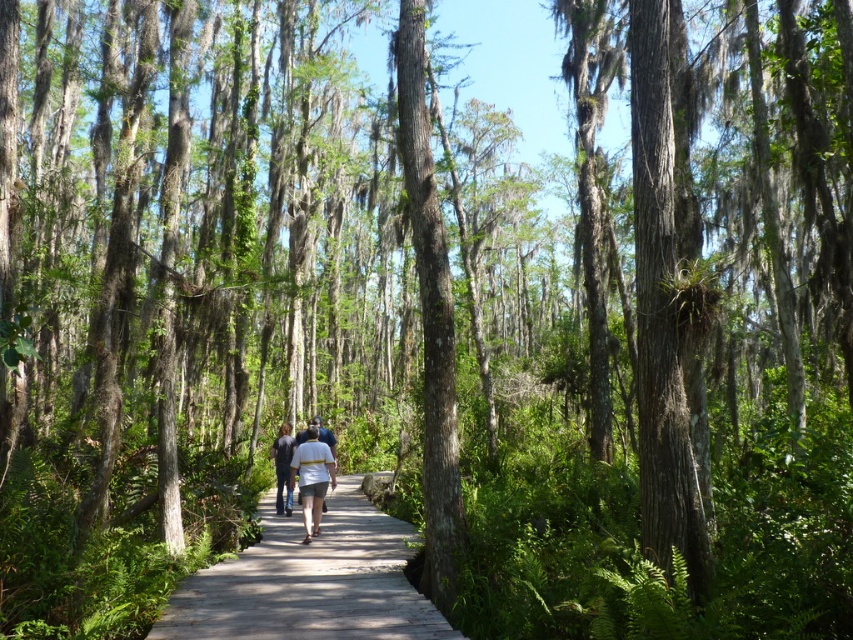
Question: Which object is closer to the camera taking this photo?

Choices:
 (A) wooden boardwalk at center
 (B) smooth bark tree at center

Answer: (A)

Question: Does smooth bark tree at center appear over dark blue jeans at center?

Choices:
 (A) no
 (B) yes

Answer: (B)

Question: Can you confirm if wooden boardwalk at center is positioned to the right of smooth bark tree at center?

Choices:
 (A) yes
 (B) no

Answer: (B)

Question: Which point is closer to the camera?

Choices:
 (A) (277, 506)
 (B) (311, 451)
 (C) (434, 572)

Answer: (C)

Question: Which point is closer to the camera taking this photo?

Choices:
 (A) (289, 512)
 (B) (281, 586)
 (C) (399, 49)
 (D) (305, 476)

Answer: (B)

Question: Is smooth bark tree at center to the right of dark blue jeans at center from the viewer's perspective?

Choices:
 (A) no
 (B) yes

Answer: (B)